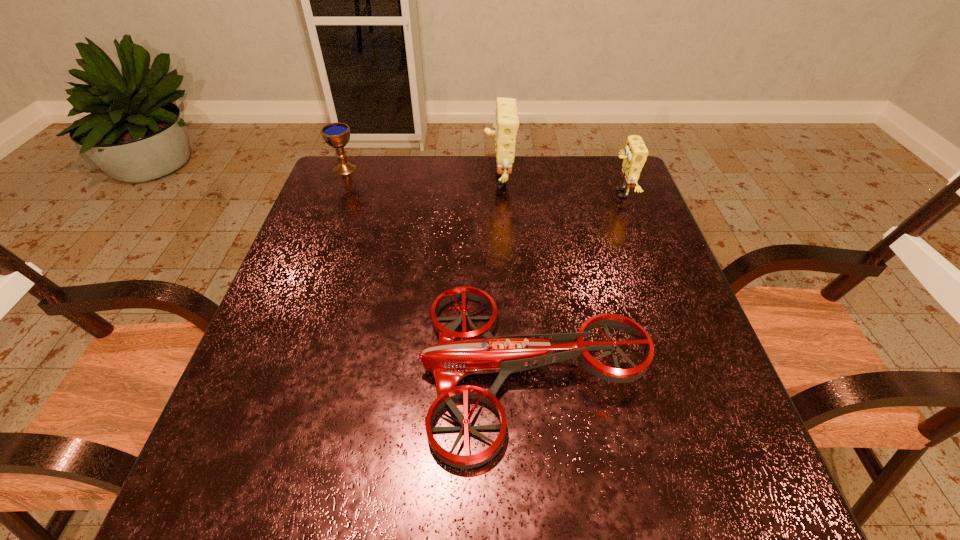
Where is `the tallest object`? the tallest object is located at coordinates (506, 124).

Where is `the taller sponge`? the taller sponge is located at coordinates (506, 124).

The width and height of the screenshot is (960, 540). In order to click on the rightmost object in this screenshot , I will do `click(635, 154)`.

This screenshot has height=540, width=960. Find the location of `the second tallest object`. the second tallest object is located at coordinates (635, 154).

Identify the location of the third tallest object. The height and width of the screenshot is (540, 960). (337, 135).

Find the location of a particular element. The image size is (960, 540). the leftmost object is located at coordinates (337, 135).

Find the location of `drone`. drone is located at coordinates (458, 354).

At what (x,y) coordinates should I click in order to perform the action: click on the nearest object. Please return your answer as a coordinate pair (x, y). Looking at the image, I should click on [458, 354].

The height and width of the screenshot is (540, 960). Find the location of `free region located on the face of the taller sponge`. free region located on the face of the taller sponge is located at coordinates (446, 178).

Locate an element on the screen. This screenshot has height=540, width=960. vacant region located 0.220m on the face of the taller sponge is located at coordinates (409, 178).